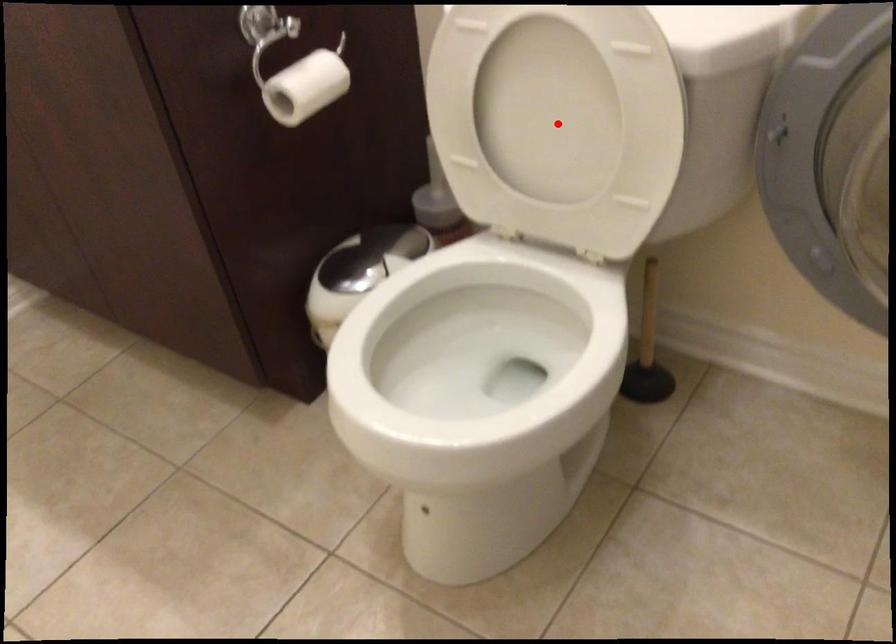
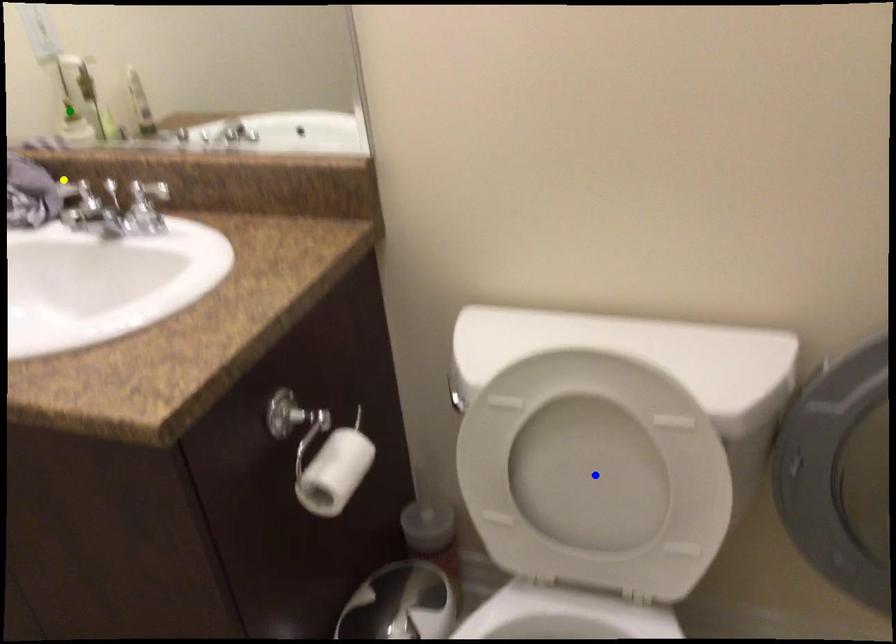
Question: I am providing you with two images of the same scene from different viewpoints. A red point is marked on the first image. You are given multiple points on the second image. Can you choose the point in image 2 that corresponds to the point in image 1?

Choices:
 (A) green point
 (B) blue point
 (C) yellow point

Answer: (B)